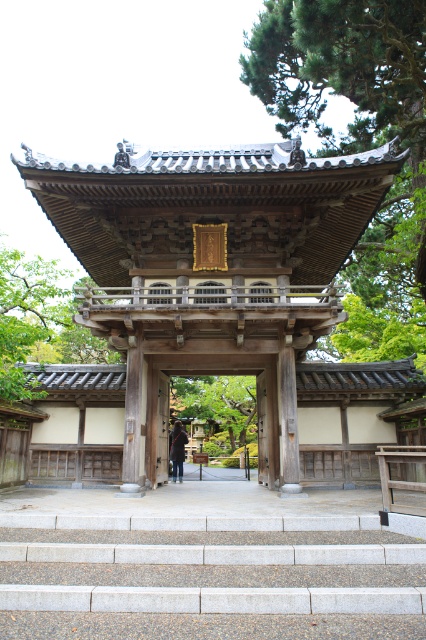
You are standing at the entrance of the temple and want to take a photo of the gray concrete stairs at lower center and the green leafy tree at center. Which object should you focus on first if you want to capture both in the frame without moving the camera?

You should focus on the green leafy tree at center first because the gray concrete stairs at lower center is positioned on the left side of it, so centering the tree will ensure both objects are in the frame.

You are standing in front of a traditional Japanese gate. There is a point marked at coordinates (x=210, y=268). What does this point represent?

The point at coordinates (x=210, y=268) marks the wooden gate at center.